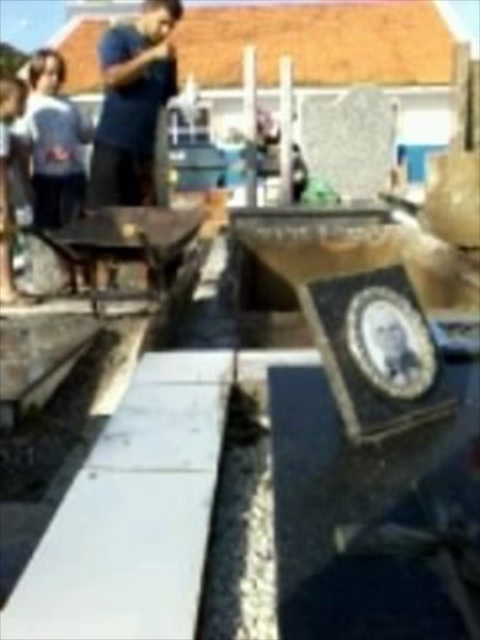
Question: Which object appears farthest from the camera in this image?

Choices:
 (A) dark blue t-shirt at upper center
 (B) white cotton shirt at upper left
 (C) matte black shirt at left

Answer: (A)

Question: Is dark blue t-shirt at upper center positioned at the back of matte black shirt at left?

Choices:
 (A) yes
 (B) no

Answer: (A)

Question: Which point is farther to the camera?

Choices:
 (A) white cotton shirt at upper left
 (B) matte black shirt at left
 (C) dark blue t-shirt at upper center

Answer: (C)

Question: In this image, where is dark blue t-shirt at upper center located relative to white cotton shirt at upper left?

Choices:
 (A) above
 (B) below

Answer: (A)

Question: Which object is the closest to the white cotton shirt at upper left?

Choices:
 (A) dark blue t-shirt at upper center
 (B) matte black shirt at left

Answer: (A)

Question: Considering the relative positions of dark blue t-shirt at upper center and white cotton shirt at upper left in the image provided, where is dark blue t-shirt at upper center located with respect to white cotton shirt at upper left?

Choices:
 (A) right
 (B) left

Answer: (A)